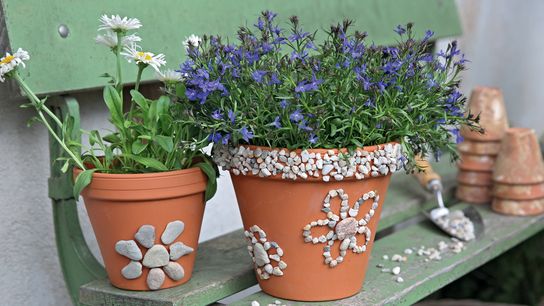
Where is `stones glued to left flowerpot`? Image resolution: width=544 pixels, height=306 pixels. stones glued to left flowerpot is located at coordinates (128, 249), (147, 239), (172, 233), (176, 250), (151, 258), (129, 270), (156, 278), (179, 273).